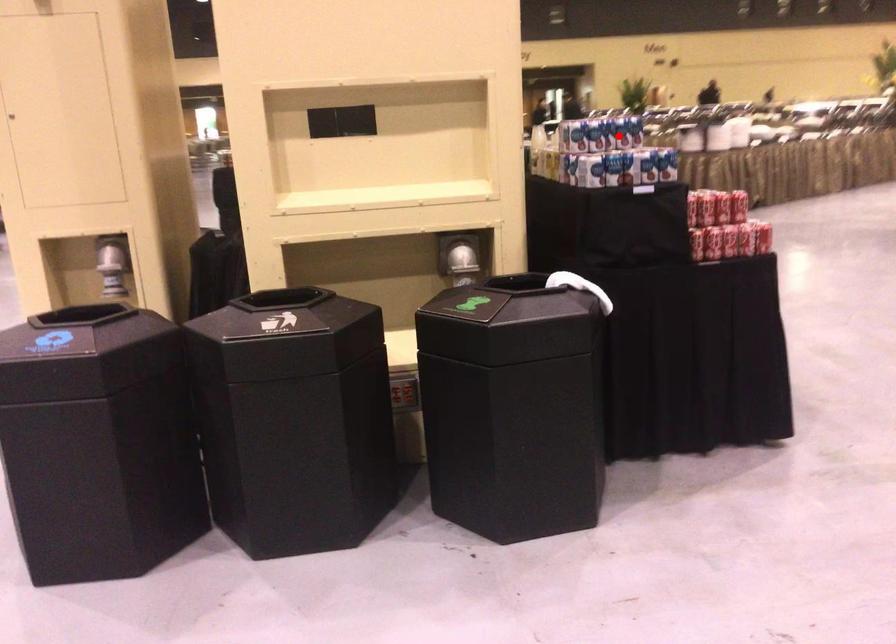
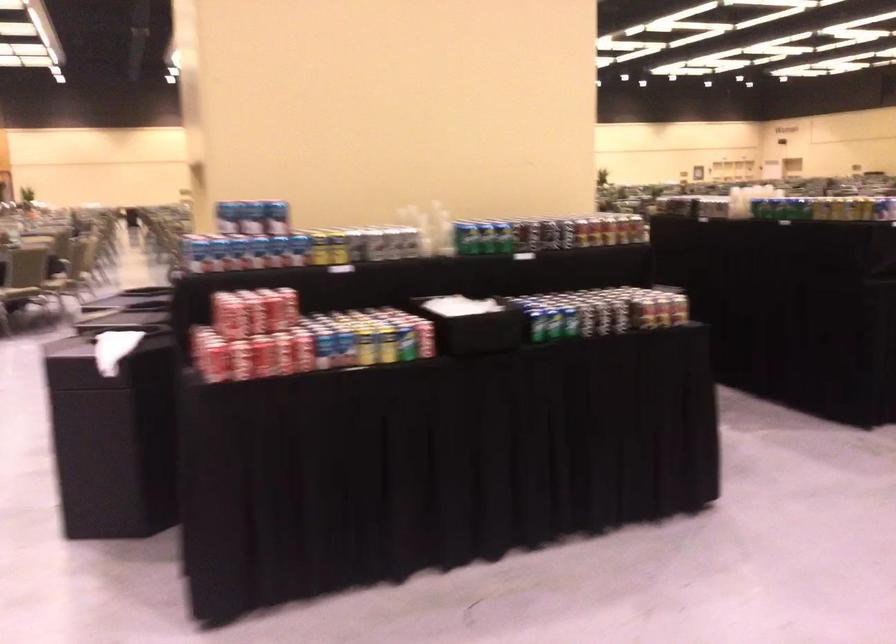
In the second image, find the point that corresponds to the highlighted location in the first image.

(229, 216)